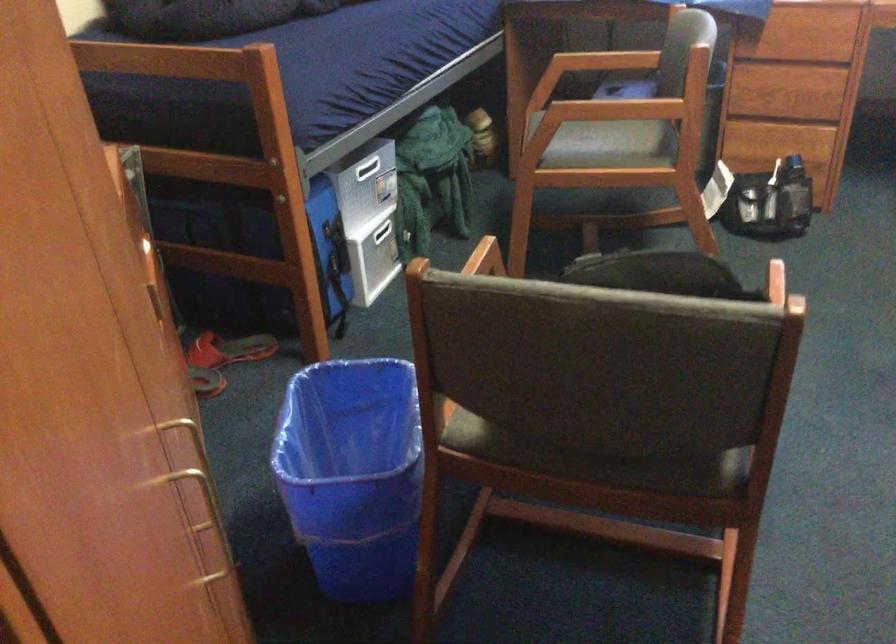
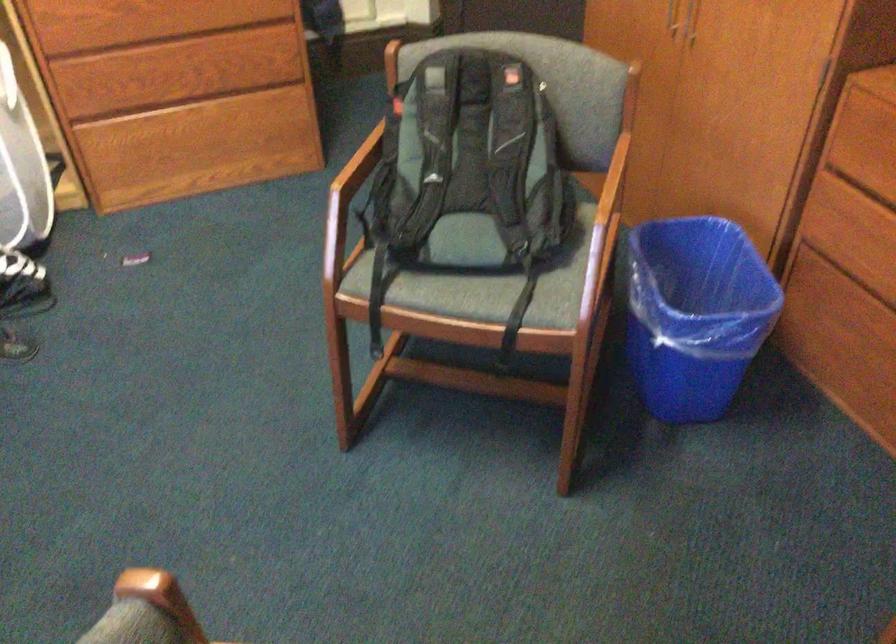
Locate, in the second image, the point that corresponds to point (754, 295) in the first image.

(350, 183)